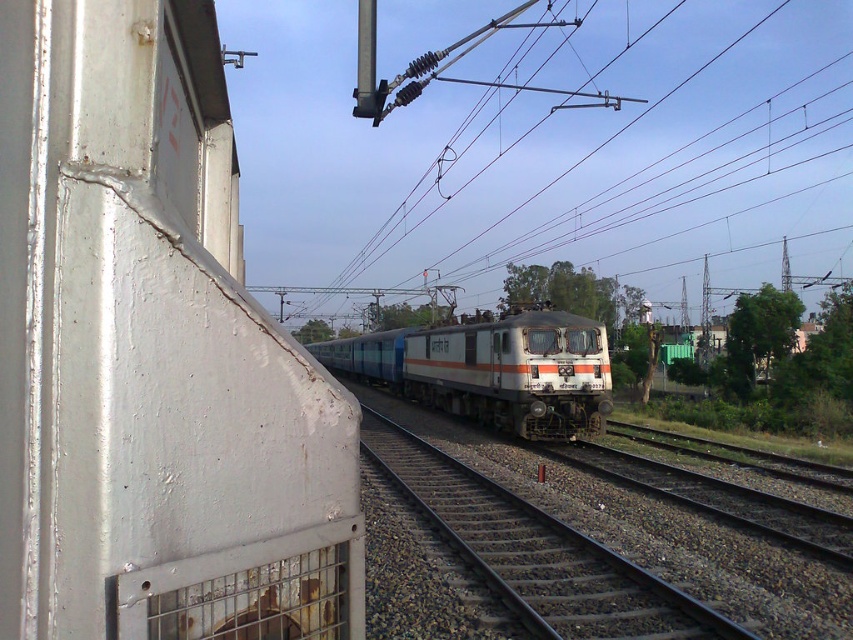
Question: Is metallic wire at upper center above silver metallic train at center?

Choices:
 (A) yes
 (B) no

Answer: (A)

Question: From the image, what is the correct spatial relationship of metallic wire at upper center in relation to silver metallic train at center?

Choices:
 (A) below
 (B) above

Answer: (B)

Question: Among these points, which one is farthest from the camera?

Choices:
 (A) (706, 109)
 (B) (402, 364)

Answer: (A)

Question: Which object appears closest to the camera in this image?

Choices:
 (A) metallic wire at upper center
 (B) silver metallic train at center

Answer: (B)

Question: Is metallic wire at upper center further to the viewer compared to silver metallic train at center?

Choices:
 (A) no
 (B) yes

Answer: (B)